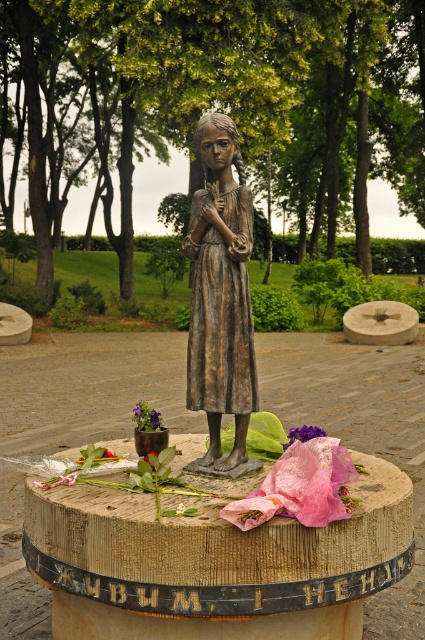
Is matte purple flower at center shorter than pink paper flower at center?

Incorrect, matte purple flower at center's height does not fall short of pink paper flower at center's.

Can you confirm if matte purple flower at center is thinner than pink paper flower at center?

In fact, matte purple flower at center might be wider than pink paper flower at center.

This screenshot has width=425, height=640. I want to click on matte purple flower at center, so click(147, 417).

Find the location of a particular element. The height and width of the screenshot is (640, 425). matte purple flower at center is located at coordinates [147, 417].

Which of these two, purple fabric flower at center or pink paper flower at center, stands shorter?

Standing shorter between the two is pink paper flower at center.

Between purple fabric flower at center and pink paper flower at center, which one appears on the right side from the viewer's perspective?

Positioned to the right is purple fabric flower at center.

Identify the location of purple fabric flower at center. The image size is (425, 640). (303, 433).

Can you confirm if green leafy at center is wider than purple fabric flower at center?

No, green leafy at center is not wider than purple fabric flower at center.

Is green leafy at center to the left of purple fabric flower at center from the viewer's perspective?

Yes, green leafy at center is to the left of purple fabric flower at center.

Where is `green leafy at center`? The width and height of the screenshot is (425, 640). green leafy at center is located at coordinates (95, 456).